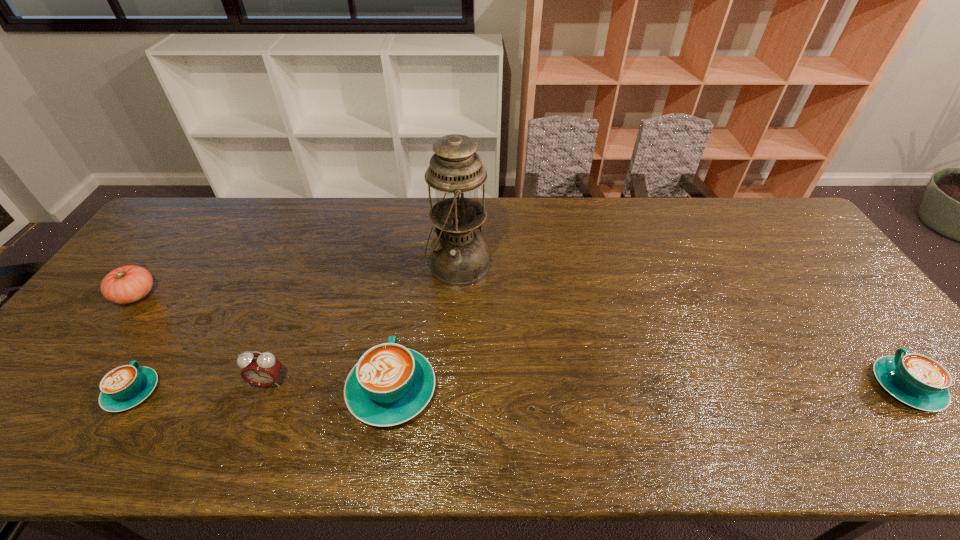
You are a GUI agent. You are given a task and a screenshot of the screen. Output one action in this format:
    pyautogui.click(x=<x>, y=<y>)
    Task: Click on the vacant area at the right edge
    This screenshot has height=540, width=960.
    Given the screenshot: What is the action you would take?
    pyautogui.click(x=873, y=356)

Where is `vacant space at the far left corner of the desktop`? This screenshot has height=540, width=960. vacant space at the far left corner of the desktop is located at coordinates (187, 213).

Locate an element on the screen. The image size is (960, 540). vacant area that lies between the shortest cappuccino and the tallest cappuccino is located at coordinates (262, 391).

The height and width of the screenshot is (540, 960). I want to click on vacant space that is in between the tomato and the oil lamp, so click(297, 280).

This screenshot has width=960, height=540. What are the coordinates of `vacant space that's between the shortest object and the alarm clock` in the screenshot? It's located at (201, 387).

Where is `vacant area between the second cappuccino from left to right and the tallest object`? The image size is (960, 540). vacant area between the second cappuccino from left to right and the tallest object is located at coordinates (424, 328).

Identify the location of vacant area between the third object from left to right and the tallest object. Image resolution: width=960 pixels, height=540 pixels. (363, 324).

This screenshot has width=960, height=540. Identify the location of free space between the shortest object and the tallest cappuccino. (262, 391).

Locate an element on the screen. This screenshot has height=540, width=960. vacant space in between the tomato and the alarm clock is located at coordinates (202, 339).

This screenshot has width=960, height=540. In order to click on object that ranks as the third closest to the tallest object in this screenshot , I will do `click(124, 387)`.